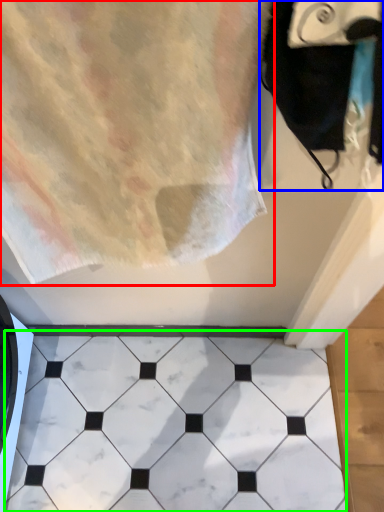
Question: Based on their relative distances, which object is farther from towel (highlighted by a red box)? Choose from bath towel (highlighted by a blue box) and marble (highlighted by a green box).

Choices:
 (A) bath towel
 (B) marble

Answer: (B)